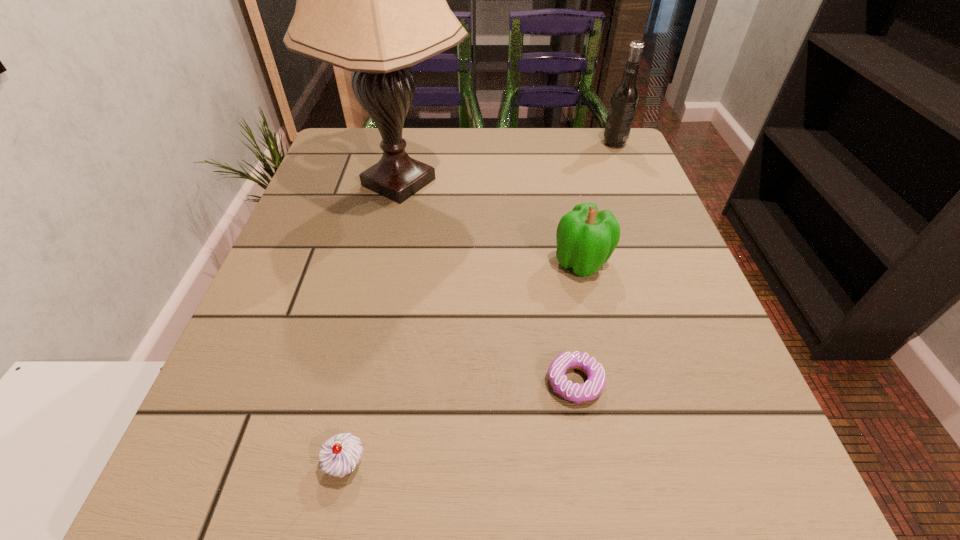
This screenshot has height=540, width=960. Find the location of `free space between the tallest object and the fourth farthest object`. free space between the tallest object and the fourth farthest object is located at coordinates (487, 282).

Locate an element on the screen. free space between the cupcake and the rightmost object is located at coordinates (480, 303).

Find the location of a particular element. free space between the doughnut and the tallest object is located at coordinates (487, 282).

At what (x,y) coordinates should I click in order to perform the action: click on empty space between the cupcake and the shortest object. Please return your answer as a coordinate pair (x, y). The width and height of the screenshot is (960, 540). Looking at the image, I should click on (460, 423).

Find the location of a particular element. This screenshot has width=960, height=540. vacant area that lies between the third shortest object and the lamp is located at coordinates (491, 222).

Locate an element on the screen. free point between the lamp and the rightmost object is located at coordinates (507, 163).

This screenshot has width=960, height=540. Find the location of `free spot between the rightmost object and the third tallest object`. free spot between the rightmost object and the third tallest object is located at coordinates (598, 203).

You are a GUI agent. You are given a task and a screenshot of the screen. Output one action in this format:
    pyautogui.click(x=<x>, y=<y>)
    Task: Click on the vacant space that is in between the cupcake and the third tallest object
    
    Given the screenshot: What is the action you would take?
    pyautogui.click(x=464, y=363)

Find the location of a particular element. the closest object to the root beer is located at coordinates (371, 0).

Where is `object that is the second closest one to the root beer`? The width and height of the screenshot is (960, 540). object that is the second closest one to the root beer is located at coordinates (586, 237).